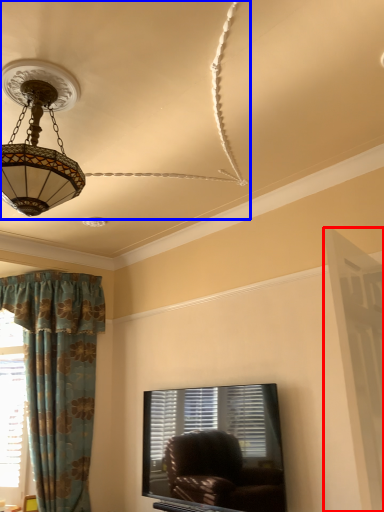
Question: Which object appears closest to the camera in this image, screen door (highlighted by a red box) or fan (highlighted by a blue box)?

Choices:
 (A) screen door
 (B) fan

Answer: (B)